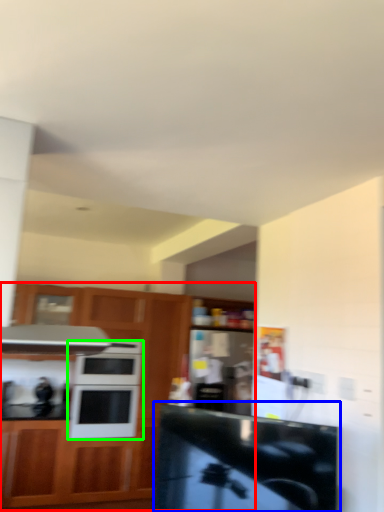
Question: Based on their relative distances, which object is nearer to cabinetry (highlighted by a red box)? Choose from counter top (highlighted by a blue box) and microwave oven (highlighted by a green box).

Choices:
 (A) counter top
 (B) microwave oven

Answer: (B)